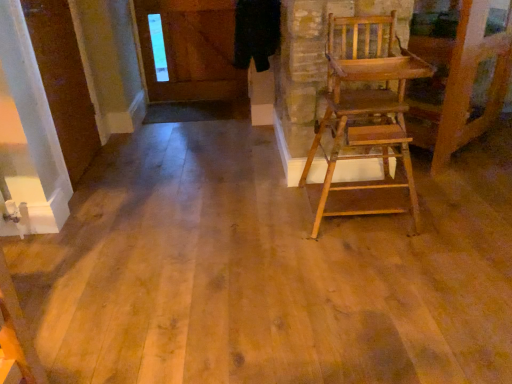
Locate an element on the screen. The width and height of the screenshot is (512, 384). free region on the left part of wooden high chair at right is located at coordinates (265, 213).